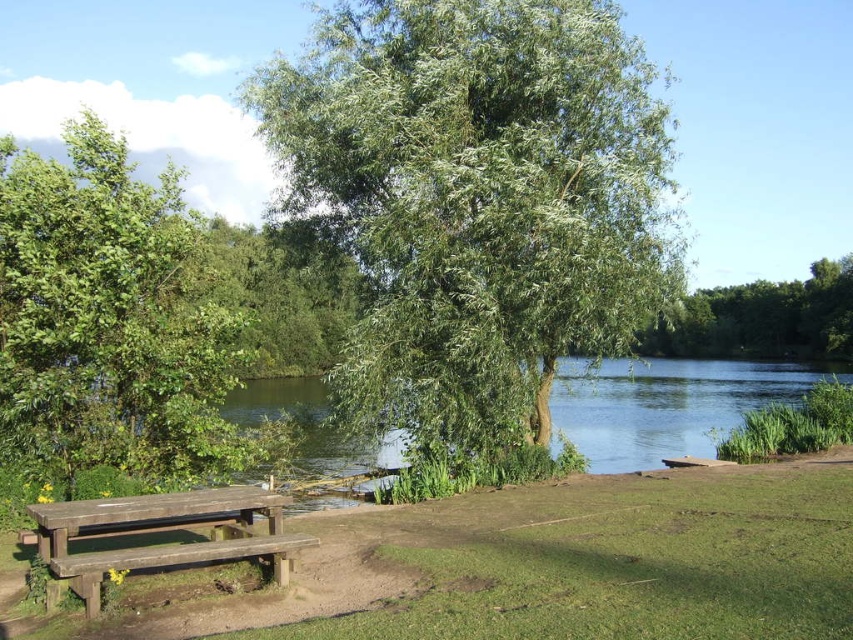
You are standing at the edge of the water and want to place a picnic basket on the green grass at lower center. Based on the coordinates provided in the description, can you determine the exact location to place it?

The green grass at lower center is located at point coordinates of (616, 561). Therefore, you should place the picnic basket at those coordinates to ensure it is on the green grass at lower center.

You are planning to have a picnic at the location shown in the image. You want to sit under the green leafy tree at center to avoid the sun. Is the weathered wood picnic table at lower left located under the tree?

Yes, the green leafy tree at center is positioned over the weathered wood picnic table at lower left, so the picnic table is indeed under the tree.

You are standing at the picnic table and want to take a photo of both point (407, 170) and point (521, 563) in the scene. Which point will appear closer to the front of the photo?

Point (407, 170) is further to the camera than point (521, 563), so it will appear closer to the front of the photo.